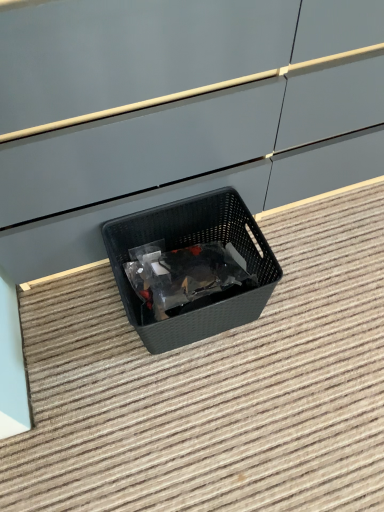
Where is `free space in front of black plastic basket at center`? The height and width of the screenshot is (512, 384). free space in front of black plastic basket at center is located at coordinates (197, 411).